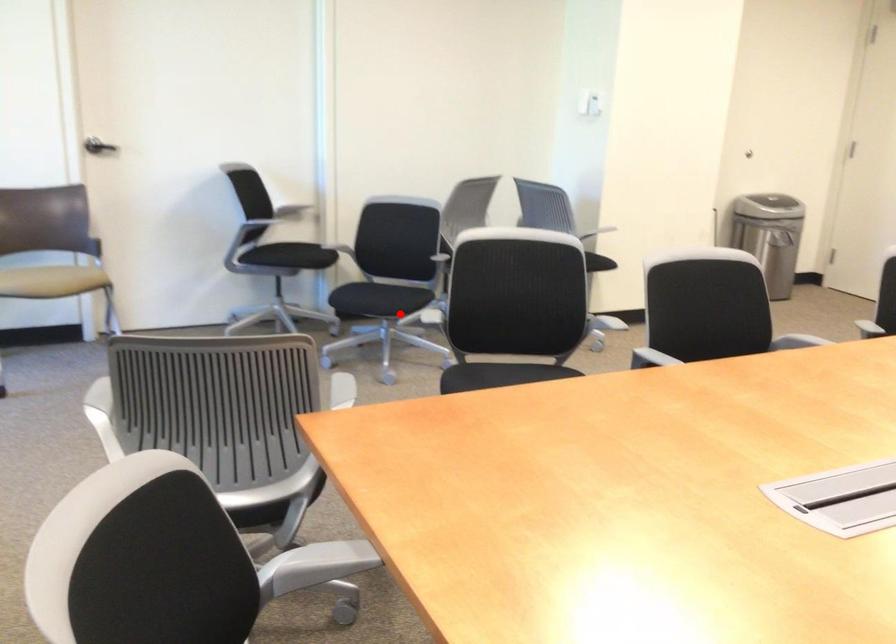
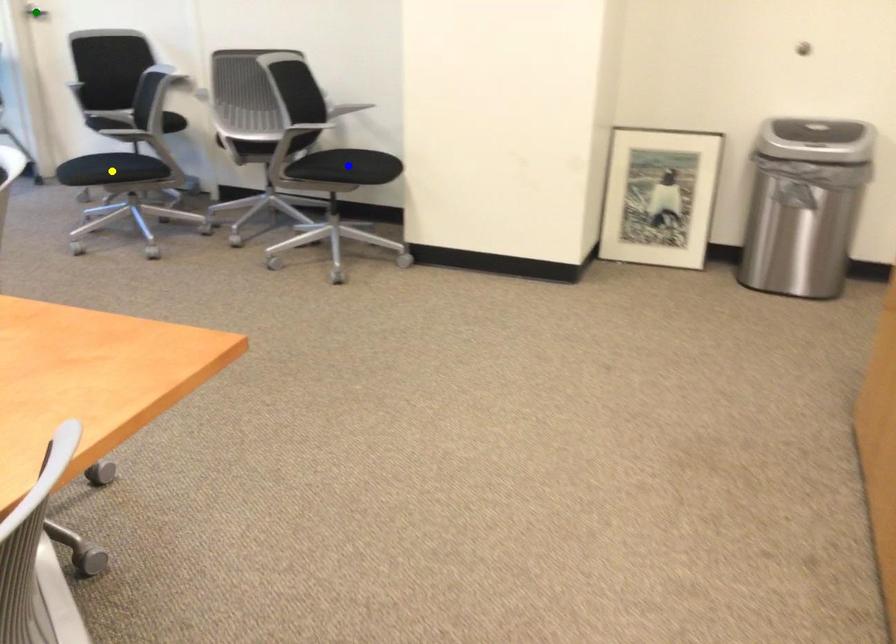
Question: I am providing you with two images of the same scene from different viewpoints. A red point is marked on the first image. You are given multiple points on the second image. Which spot in image 2 lines up with the point in image 1?

Choices:
 (A) blue point
 (B) green point
 (C) yellow point

Answer: (C)